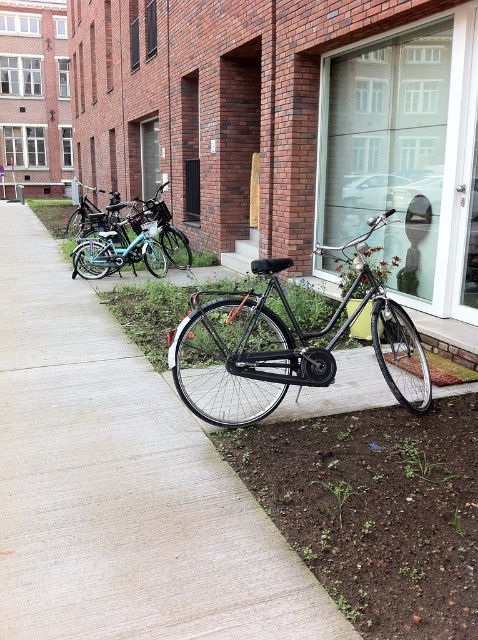
Based on the photo, is matte black bicycle at center bigger than shiny black bicycle at center?

Yes, matte black bicycle at center is bigger than shiny black bicycle at center.

Can you confirm if matte black bicycle at center is positioned to the left of shiny black bicycle at center?

Indeed, matte black bicycle at center is positioned on the left side of shiny black bicycle at center.

Does point (156, 481) come farther from viewer compared to point (191, 348)?

No, it is in front of (191, 348).

This screenshot has height=640, width=478. Identify the location of matte black bicycle at center. (120, 484).

Looking at this image, who is shorter, matte black bicycle at center or shiny teal bicycle at center-left?

shiny teal bicycle at center-left

The image size is (478, 640). What do you see at coordinates (120, 484) in the screenshot?
I see `matte black bicycle at center` at bounding box center [120, 484].

You are a GUI agent. You are given a task and a screenshot of the screen. Output one action in this format:
    pyautogui.click(x=<x>, y=<y>)
    Task: Click on the matte black bicycle at center
    The height and width of the screenshot is (640, 478).
    Given the screenshot: What is the action you would take?
    pyautogui.click(x=120, y=484)

Between shiny black bicycle at center and shiny teal bicycle at center-left, which one appears on the left side from the viewer's perspective?

Positioned to the left is shiny teal bicycle at center-left.

Can you confirm if shiny black bicycle at center is smaller than shiny teal bicycle at center-left?

Incorrect, shiny black bicycle at center is not smaller in size than shiny teal bicycle at center-left.

You are a GUI agent. You are given a task and a screenshot of the screen. Output one action in this format:
    pyautogui.click(x=<x>, y=<y>)
    Task: Click on the shiny black bicycle at center
    The width and height of the screenshot is (478, 640).
    Given the screenshot: What is the action you would take?
    pyautogui.click(x=294, y=340)